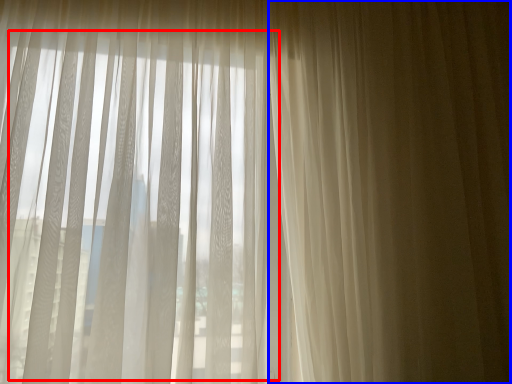
Question: Among these objects, which one is nearest to the camera, bay window (highlighted by a red box) or curtain (highlighted by a blue box)?

Choices:
 (A) bay window
 (B) curtain

Answer: (A)